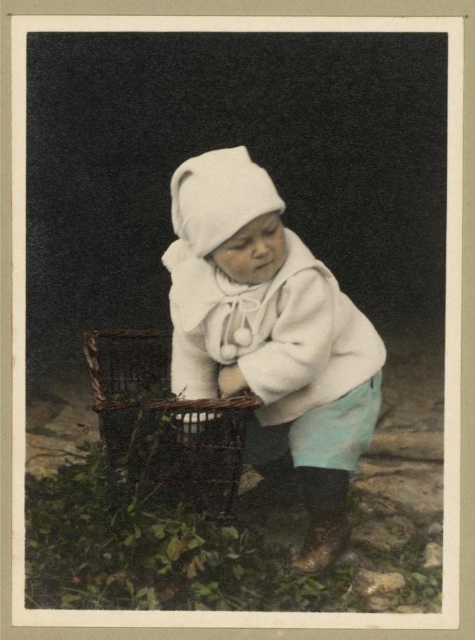
Who is positioned more to the right, white soft cloth at center or woven brown basket at lower left?

Positioned to the right is white soft cloth at center.

Can you confirm if white soft cloth at center is positioned to the left of woven brown basket at lower left?

No, white soft cloth at center is not to the left of woven brown basket at lower left.

Identify the location of white soft cloth at center. (271, 330).

Locate an element on the screen. This screenshot has height=640, width=475. white soft cloth at center is located at coordinates (271, 330).